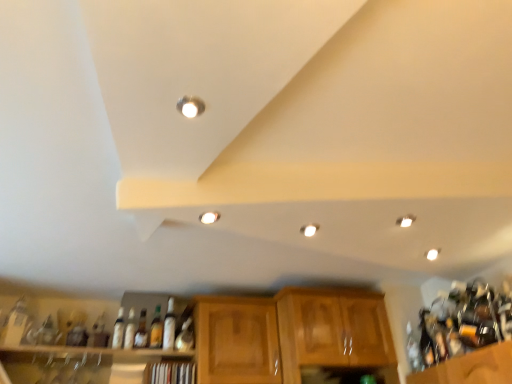
Question: In which direction should I rotate to look at matte glass bottle at center, the 6th bottle in the left-to-right sequence?

Choices:
 (A) left
 (B) right

Answer: (A)

Question: Is wooden cabinet at center, positioned as the 2th cabinetry in right-to-left order, next to matte glass bottle at center, placed as the 3th bottle when sorted from right to left, and touching it?

Choices:
 (A) yes
 (B) no

Answer: (B)

Question: Can you confirm if wooden cabinet at center, positioned as the 2th cabinetry in right-to-left order, is shorter than matte glass bottle at center, placed as the 3th bottle when sorted from right to left?

Choices:
 (A) no
 (B) yes

Answer: (A)

Question: Is wooden cabinet at center, which is the 1th cabinetry from left to right, in front of matte glass bottle at center, the 6th bottle in the left-to-right sequence?

Choices:
 (A) yes
 (B) no

Answer: (A)

Question: Could matte glass bottle at center, placed as the 3th bottle when sorted from right to left, be considered to be inside wooden cabinet at center, which is the 1th cabinetry from left to right?

Choices:
 (A) no
 (B) yes

Answer: (A)

Question: Is wooden cabinet at center, positioned as the 2th cabinetry in right-to-left order, at the left side of matte glass bottle at center, placed as the 3th bottle when sorted from right to left?

Choices:
 (A) yes
 (B) no

Answer: (B)

Question: Would you say wooden cabinet at center, positioned as the 2th cabinetry in right-to-left order, is outside matte glass bottle at center, placed as the 3th bottle when sorted from right to left?

Choices:
 (A) no
 (B) yes

Answer: (B)

Question: Is white glossy light fixture at center, which is the 2th lighting in front-to-back order, surrounded by matte glass bottle at lower left, arranged as the 8th bottle when viewed from the right?

Choices:
 (A) yes
 (B) no

Answer: (B)

Question: Is matte glass bottle at lower left, marked as the 1th bottle in a left-to-right arrangement, positioned beyond the bounds of white glossy light fixture at center, the second lighting from the left?

Choices:
 (A) no
 (B) yes

Answer: (B)

Question: Is the depth of matte glass bottle at lower left, arranged as the 8th bottle when viewed from the right, less than that of white glossy light fixture at center, the third lighting when ordered from right to left?

Choices:
 (A) yes
 (B) no

Answer: (B)

Question: Can you confirm if matte glass bottle at lower left, arranged as the 8th bottle when viewed from the right, is smaller than white glossy light fixture at center, the third lighting when ordered from right to left?

Choices:
 (A) yes
 (B) no

Answer: (B)

Question: Is matte glass bottle at lower left, arranged as the 8th bottle when viewed from the right, in contact with white glossy light fixture at center, which is counted as the 3th lighting, starting from the bottom?

Choices:
 (A) yes
 (B) no

Answer: (B)

Question: From a real-world perspective, is matte glass bottle at lower left, arranged as the 8th bottle when viewed from the right, located beneath white glossy light fixture at center, placed as the 3th lighting when sorted from back to front?

Choices:
 (A) no
 (B) yes

Answer: (B)

Question: Considering the relative sizes of clear glass bottle at right, the first bottle positioned from the right, and wooden shelf at lower center, marked as the 1th shelf in a right-to-left arrangement, in the image provided, is clear glass bottle at right, the first bottle positioned from the right, smaller than wooden shelf at lower center, marked as the 1th shelf in a right-to-left arrangement,?

Choices:
 (A) no
 (B) yes

Answer: (B)